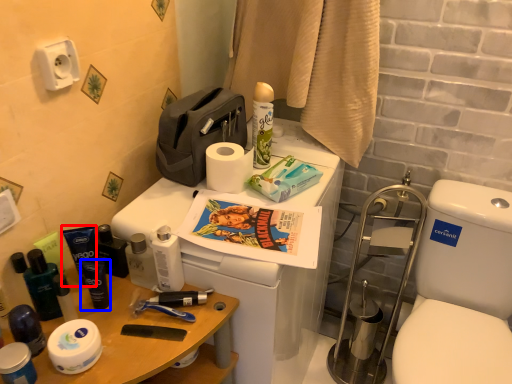
Question: Which object appears closest to the camera in this image, toiletry (highlighted by a red box) or toiletry (highlighted by a blue box)?

Choices:
 (A) toiletry
 (B) toiletry

Answer: (B)